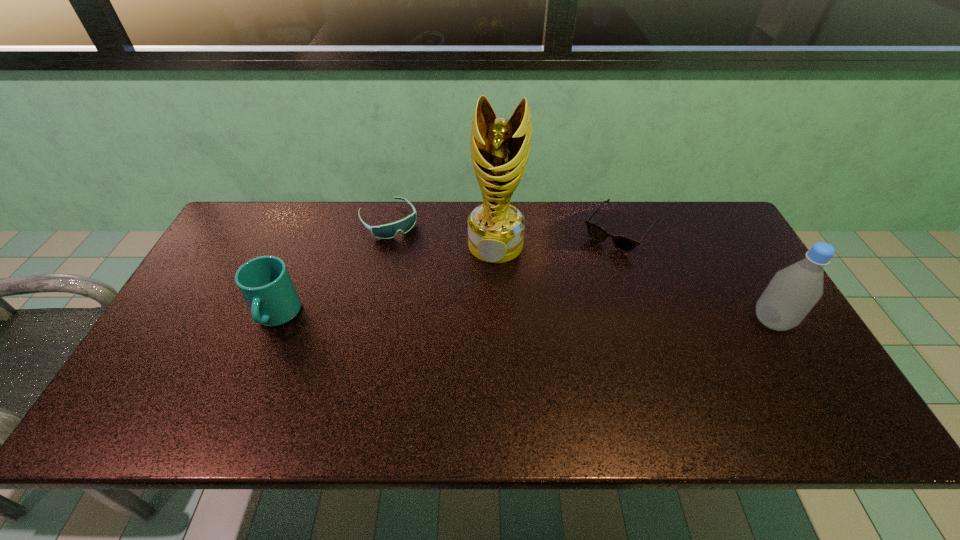
This screenshot has height=540, width=960. I want to click on free space on the desktop that is between the cup and the bottle and is positioned on the front-facing side of the tallest object, so click(478, 318).

You are a GUI agent. You are given a task and a screenshot of the screen. Output one action in this format:
    pyautogui.click(x=<x>, y=<y>)
    Task: Click on the free space on the desktop that is between the third tallest object and the rightmost object and is positioned on the front lenses of the sunglasses
    The width and height of the screenshot is (960, 540).
    Given the screenshot: What is the action you would take?
    pyautogui.click(x=550, y=319)

I want to click on vacant space on the desktop that is between the cup and the rightmost object and is positioned on the front-facing side of the fourth object from right to left, so click(459, 318).